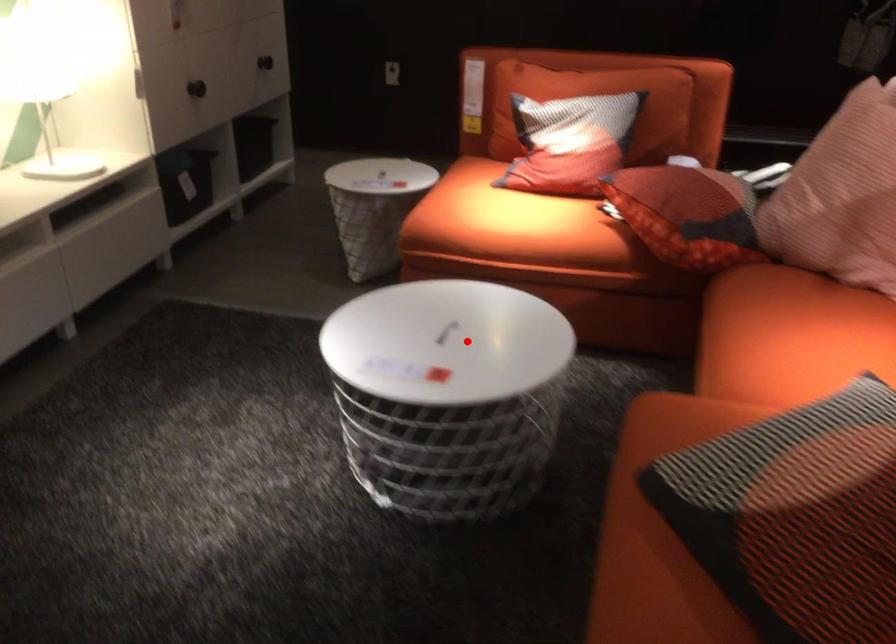
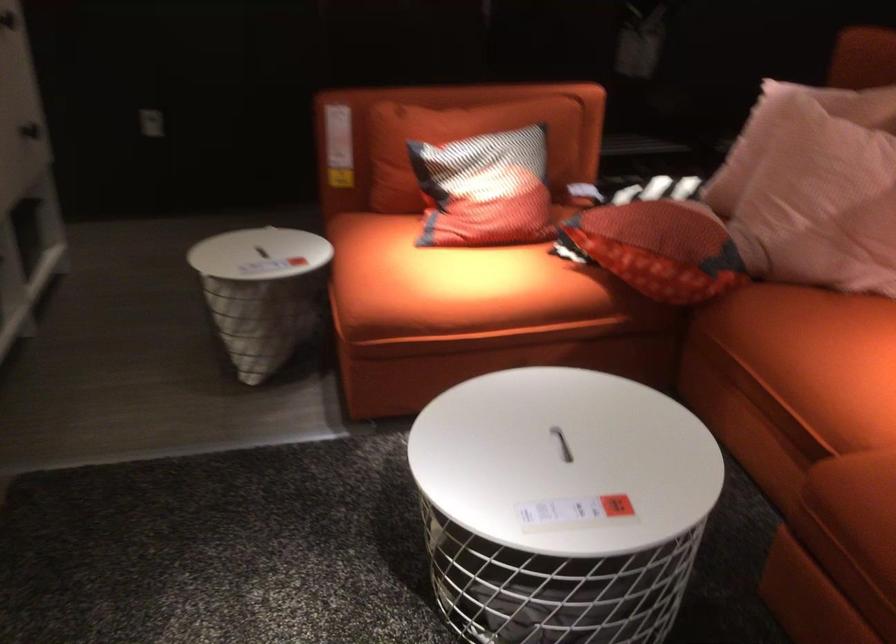
Find the pixel in the second image that matches the highlighted location in the first image.

(562, 444)